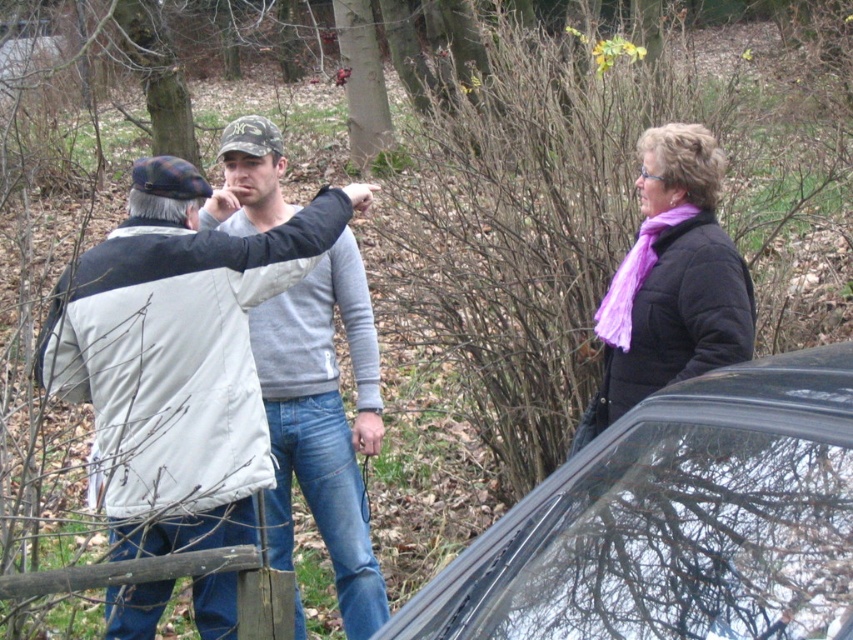
You are standing in the wooded area and see the black glossy car at lower right and the camo fabric baseball cap at center. Which object is positioned more to the east if the car is to the right of the cap?

The black glossy car at lower right is positioned more to the east because it is to the right of the camo fabric baseball cap at center.

You are standing in the wooded area and want to walk from point (224,189) to point (685,371). Which direction should you move relative to your current position?

You should move away from yourself because point (685,371) is further away than point (224,189).

You are standing in the wooded area and want to take a photo of both point (125, 444) and point (321, 349) in the scene. Which point should you focus on first to ensure both are in clear view?

You should focus on point (125, 444) first because it is closer to the camera than point (321, 349). By focusing on the closer point, both points will be in clear view due to the depth of field.